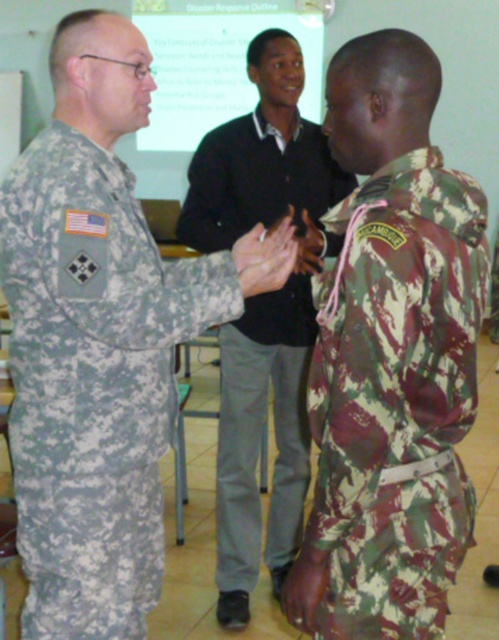
Does point (423, 314) come farther from viewer compared to point (247, 228)?

No, it is not.

Is point (477, 244) more distant than point (229, 516)?

No, it is in front of (229, 516).

Find the location of a particular element. camouflage fabric uniform at right is located at coordinates (397, 397).

Which is above, camouflage fabric uniform at left or camo fabric uniform at center?

camo fabric uniform at center

Between camouflage fabric uniform at left and camo fabric uniform at center, which one is positioned lower?

Positioned lower is camouflage fabric uniform at left.

Measure the distance between point (147, 440) and camera.

Point (147, 440) is 5.52 feet from camera.

Locate an element on the screen. The height and width of the screenshot is (640, 499). camouflage fabric uniform at left is located at coordinates [92, 381].

Between camouflage fabric uniform at left and camouflage fabric uniform at right, which one has less height?

camouflage fabric uniform at right

What do you see at coordinates (92, 381) in the screenshot?
I see `camouflage fabric uniform at left` at bounding box center [92, 381].

The image size is (499, 640). Identify the location of camouflage fabric uniform at left. (92, 381).